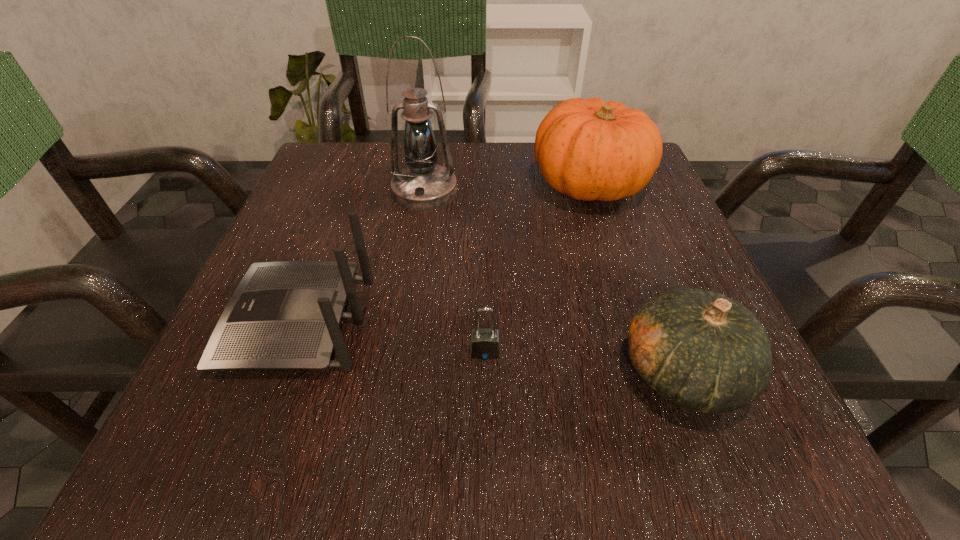
Locate an element on the screen. Image resolution: width=960 pixels, height=540 pixels. vacant point that satisfies the following two spatial constraints: 1. on the front side of the oil lamp; 2. on the front-facing side of the router is located at coordinates (404, 321).